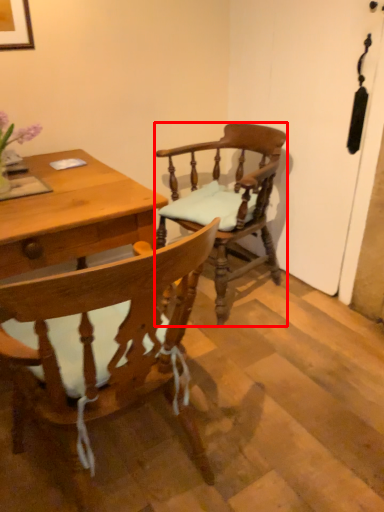
Question: From the image's perspective, considering the relative positions of chair (annotated by the red box) and chair in the image provided, where is chair (annotated by the red box) located with respect to the staircase?

Choices:
 (A) above
 (B) below

Answer: (A)